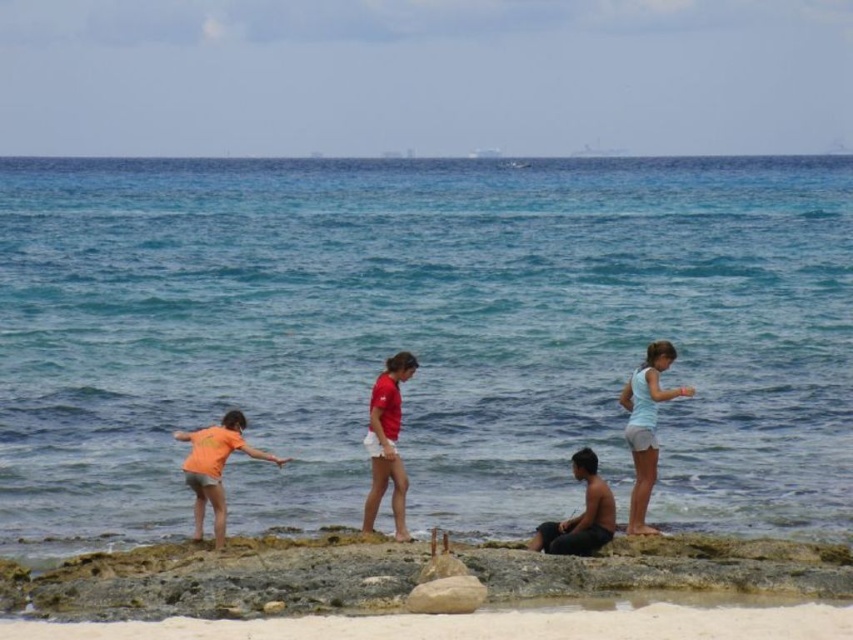
Question: Does matte red shirt at center have a smaller size compared to smooth gray rock at center?

Choices:
 (A) yes
 (B) no

Answer: (B)

Question: Which point appears farthest from the camera in this image?

Choices:
 (A) (677, 390)
 (B) (566, 525)
 (C) (210, 458)

Answer: (A)

Question: Can you confirm if smooth rock at lower center is bigger than smooth gray rock at center?

Choices:
 (A) yes
 (B) no

Answer: (A)

Question: Does clear blue water at center have a lesser width compared to smooth rock at lower center?

Choices:
 (A) yes
 (B) no

Answer: (B)

Question: Considering the real-world distances, which object is closest to the light blue denim shorts at right?

Choices:
 (A) shiny black shorts at lower center
 (B) clear blue water at center

Answer: (A)

Question: Which point appears farthest from the camera in this image?

Choices:
 (A) (440, 600)
 (B) (213, 438)
 (C) (386, 470)
 (D) (595, 454)

Answer: (D)